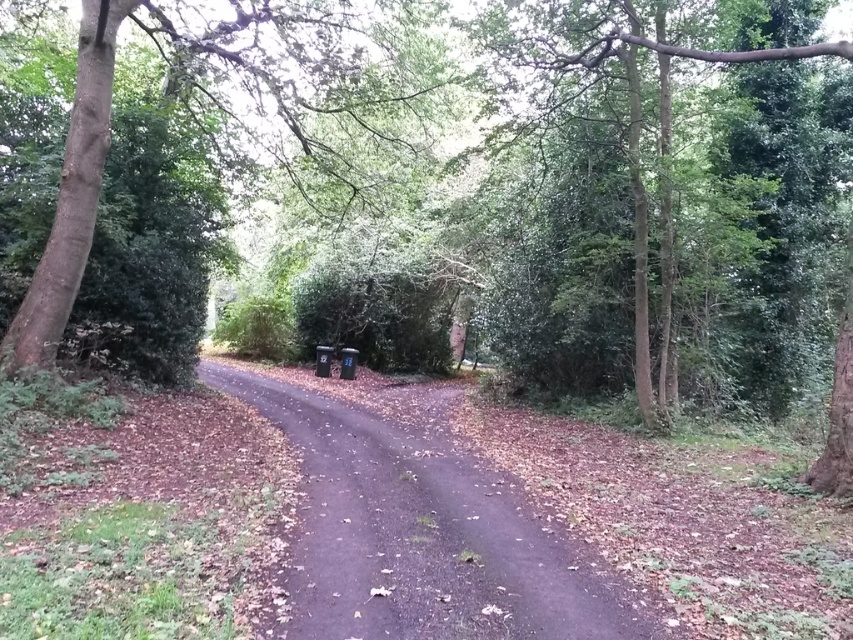
Question: In this image, where is brown dirt track at center located relative to green leafy tree at upper center?

Choices:
 (A) below
 (B) above

Answer: (A)

Question: Does brown textured tree at left appear over green leafy tree at upper center?

Choices:
 (A) yes
 (B) no

Answer: (B)

Question: Can you confirm if brown textured tree at left is bigger than brown dirt track at center?

Choices:
 (A) yes
 (B) no

Answer: (A)

Question: Which of the following is the farthest from the observer?

Choices:
 (A) green leafy tree at upper center
 (B) brown textured tree at left
 (C) brown dirt track at center

Answer: (B)

Question: Estimate the real-world distances between objects in this image. Which object is farther from the green leafy tree at upper center?

Choices:
 (A) brown dirt track at center
 (B) brown textured tree at left

Answer: (A)

Question: Which point appears farthest from the camera in this image?

Choices:
 (A) (207, 378)
 (B) (631, 13)

Answer: (A)